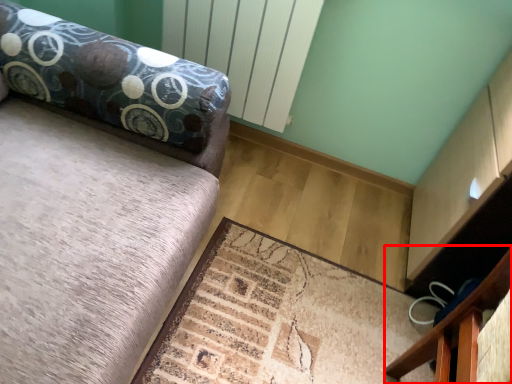
Question: Where is furniture (annotated by the red box) located in relation to mat in the image?

Choices:
 (A) right
 (B) left

Answer: (A)